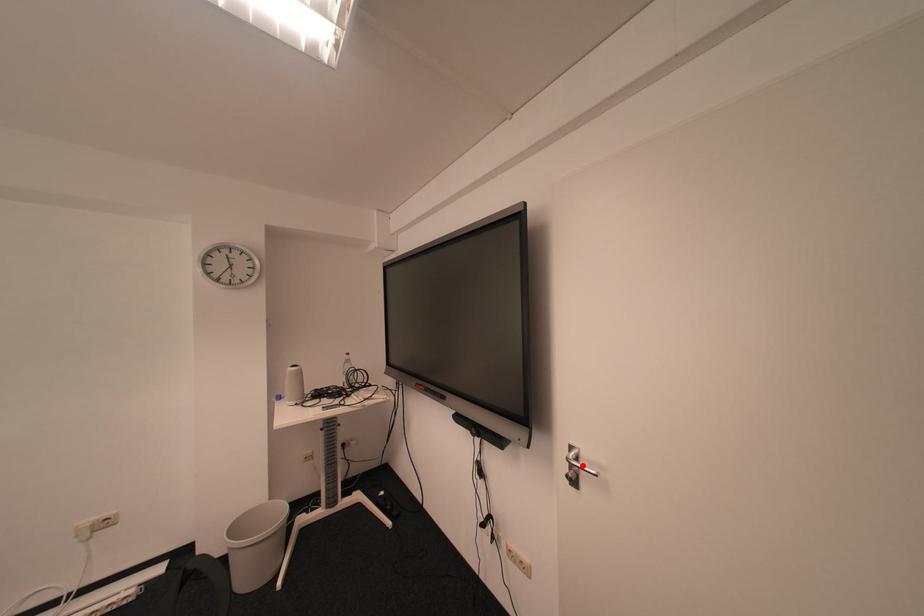
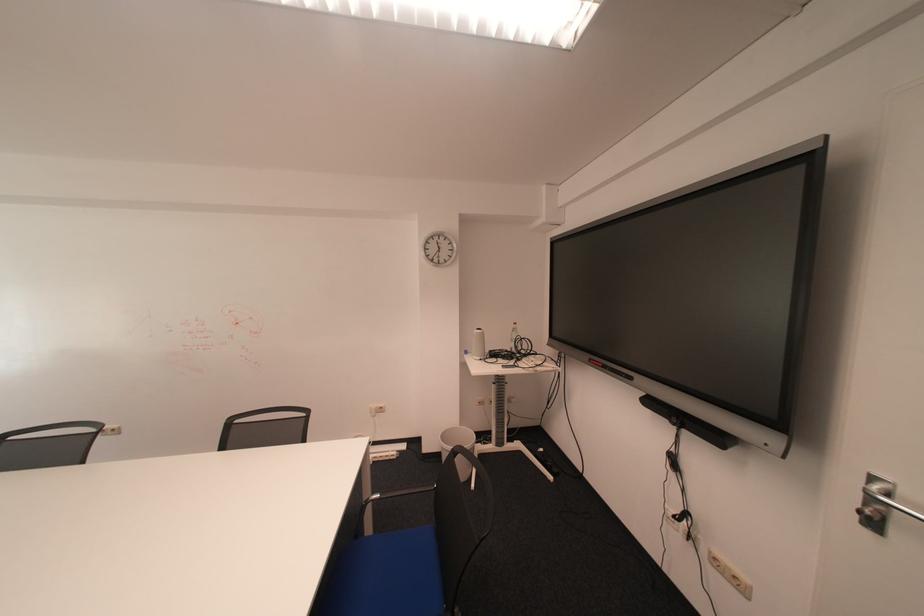
In the second image, find the point that corresponds to the highlighted location in the first image.

(884, 501)